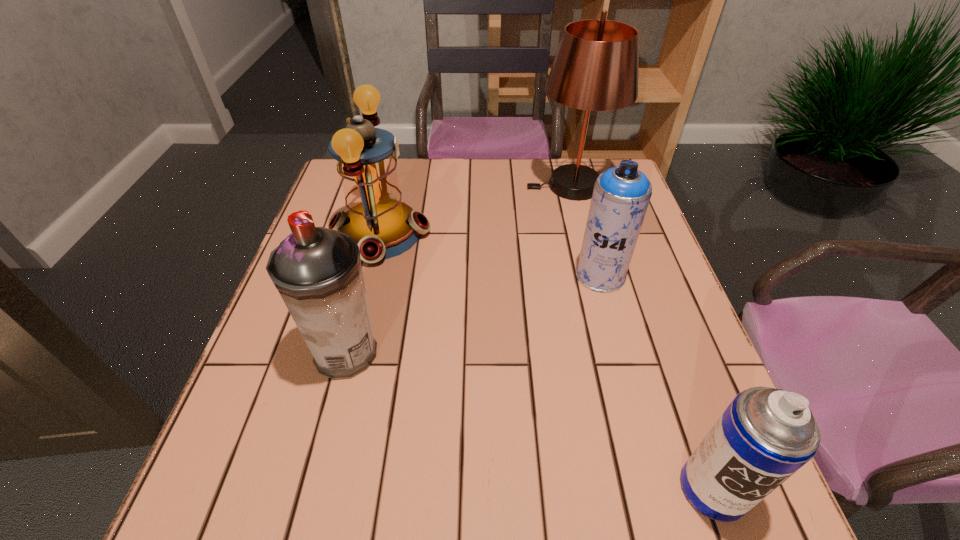
I want to click on lampshade, so click(x=595, y=68).

This screenshot has height=540, width=960. I want to click on lantern, so click(383, 227).

Locate an element on the screen. This screenshot has width=960, height=540. the fourth farthest object is located at coordinates (317, 271).

This screenshot has height=540, width=960. I want to click on the leftmost aerosol can, so click(317, 271).

You are a GUI agent. You are given a task and a screenshot of the screen. Output one action in this format:
    pyautogui.click(x=<x>, y=<y>)
    Task: Click on the farthest aerosol can
    
    Given the screenshot: What is the action you would take?
    pyautogui.click(x=621, y=195)

In order to click on the nearest aerosol can in this screenshot , I will do `click(765, 435)`.

You are a GUI agent. You are given a task and a screenshot of the screen. Output one action in this format:
    pyautogui.click(x=<x>, y=<y>)
    Task: Click on the free space located on the front-facing side of the lampshade
    This screenshot has height=540, width=960.
    Given the screenshot: What is the action you would take?
    pyautogui.click(x=476, y=186)

At what (x,y) coordinates should I click in order to perform the action: click on free location located on the front-facing side of the lampshade. Please return your answer as a coordinate pair (x, y). The height and width of the screenshot is (540, 960). Looking at the image, I should click on (446, 186).

Identify the location of vacant area situated on the front-facing side of the lampshade. This screenshot has height=540, width=960. (396, 186).

In order to click on free region located 0.310m on the front-facing side of the lantern in this screenshot , I will do `click(549, 233)`.